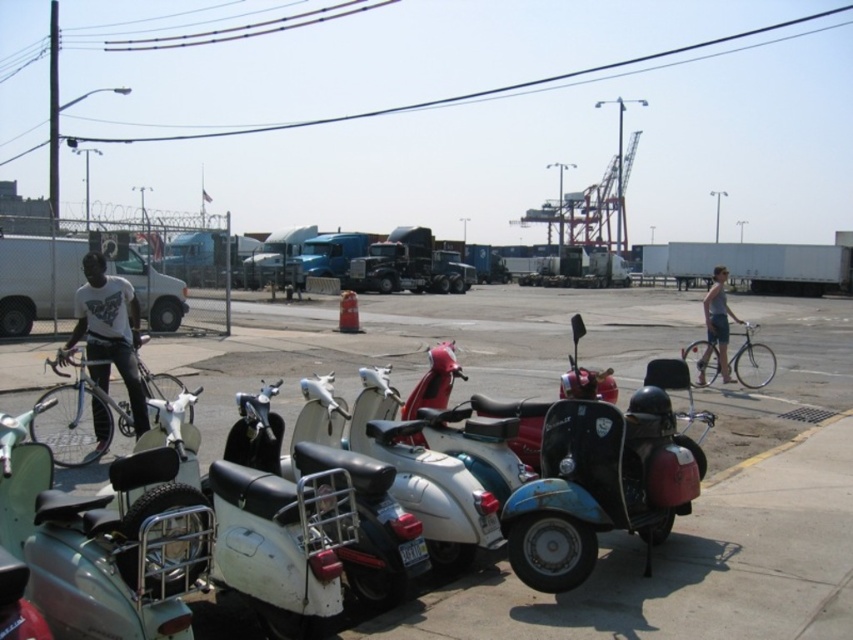
Is blue matte scooter at center shorter than skinny jeans at right?

Yes.

Is point (657, 492) farther from camera compared to point (721, 298)?

That is False.

Who is more forward, (563, 500) or (712, 326)?

Point (563, 500)

Find the location of a particular element. blue matte scooter at center is located at coordinates (602, 481).

Is smooth concrete pavement at center closer to camera compared to blue matte scooter at center?

Yes, it is in front of blue matte scooter at center.

Can you confirm if smooth concrete pavement at center is positioned to the right of blue matte scooter at center?

In fact, smooth concrete pavement at center is to the left of blue matte scooter at center.

Is point (724, 538) positioned in front of point (608, 420)?

No, (724, 538) is behind (608, 420).

Locate an element on the screen. This screenshot has width=853, height=640. smooth concrete pavement at center is located at coordinates (688, 566).

Which is behind, point (218, 358) or point (10, 467)?

Point (218, 358)

Is metallic scooters at center to the left of metallic silver scooter at lower left from the viewer's perspective?

Incorrect, metallic scooters at center is not on the left side of metallic silver scooter at lower left.

This screenshot has height=640, width=853. Find the location of `metallic scooters at center`. metallic scooters at center is located at coordinates (668, 579).